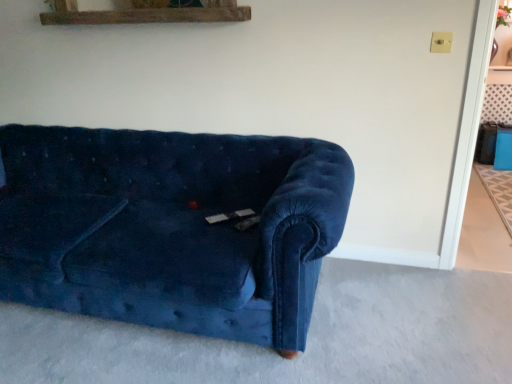
Question: From the image's perspective, is beige carpet at lower right, which appears as the second concrete when viewed from the left, positioned above or below velvet couch at lower left, which is counted as the first concrete, starting from the front?

Choices:
 (A) below
 (B) above

Answer: (B)

Question: Visually, is beige carpet at lower right, the first concrete in the back-to-front sequence, positioned to the left or to the right of velvet couch at lower left, marked as the 1th concrete in a left-to-right arrangement?

Choices:
 (A) left
 (B) right

Answer: (B)

Question: Estimate the real-world distances between objects in this image. Which object is farther from the velvet blue couch at center?

Choices:
 (A) beige carpet at lower right, which appears as the second concrete when viewed from the left
 (B) velvet couch at lower left, the 2th concrete when ordered from top to bottom

Answer: (A)

Question: Estimate the real-world distances between objects in this image. Which object is closer to the velvet blue couch at center?

Choices:
 (A) velvet couch at lower left, the 2th concrete when ordered from top to bottom
 (B) beige carpet at lower right, the first concrete in the back-to-front sequence

Answer: (A)